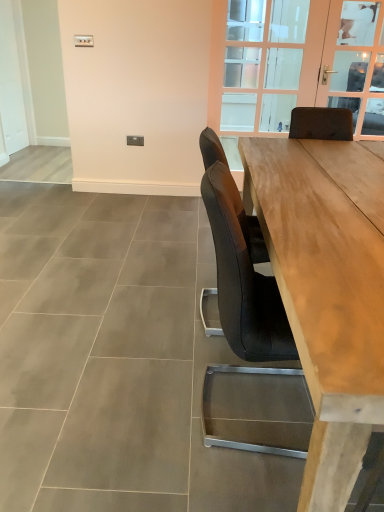
Question: Does clear glass door at upper center touch clear glass door at upper right?

Choices:
 (A) yes
 (B) no

Answer: (B)

Question: Is clear glass door at upper center taller than clear glass door at upper right?

Choices:
 (A) yes
 (B) no

Answer: (A)

Question: Does clear glass door at upper center come behind clear glass door at upper right?

Choices:
 (A) no
 (B) yes

Answer: (A)

Question: Is clear glass door at upper center bigger than clear glass door at upper right?

Choices:
 (A) no
 (B) yes

Answer: (B)

Question: Considering the relative positions of clear glass door at upper center and clear glass door at upper right in the image provided, is clear glass door at upper center to the left of clear glass door at upper right from the viewer's perspective?

Choices:
 (A) yes
 (B) no

Answer: (A)

Question: In terms of height, does clear glass door at upper right look taller or shorter compared to white matte door at left?

Choices:
 (A) short
 (B) tall

Answer: (A)

Question: From a real-world perspective, is clear glass door at upper right physically located above or below white matte door at left?

Choices:
 (A) below
 (B) above

Answer: (B)

Question: From the image's perspective, relative to white matte door at left, is clear glass door at upper right above or below?

Choices:
 (A) above
 (B) below

Answer: (B)

Question: In terms of width, does clear glass door at upper right look wider or thinner when compared to white matte door at left?

Choices:
 (A) thin
 (B) wide

Answer: (A)

Question: Does point (369, 350) appear closer or farther from the camera than point (8, 71)?

Choices:
 (A) closer
 (B) farther

Answer: (A)

Question: Is natural wood table at center in front of or behind white matte door at left in the image?

Choices:
 (A) behind
 (B) front

Answer: (B)

Question: Would you say natural wood table at center is to the left or to the right of white matte door at left in the picture?

Choices:
 (A) right
 (B) left

Answer: (A)

Question: Choose the correct answer: Is natural wood table at center inside white matte door at left or outside it?

Choices:
 (A) inside
 (B) outside

Answer: (B)

Question: From a real-world perspective, is clear glass door at upper right above or below natural wood table at center?

Choices:
 (A) above
 (B) below

Answer: (A)

Question: In terms of width, does clear glass door at upper right look wider or thinner when compared to natural wood table at center?

Choices:
 (A) wide
 (B) thin

Answer: (B)